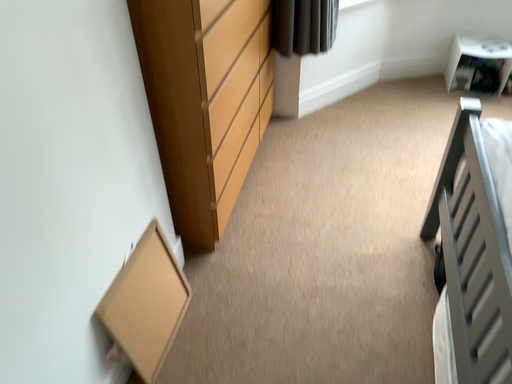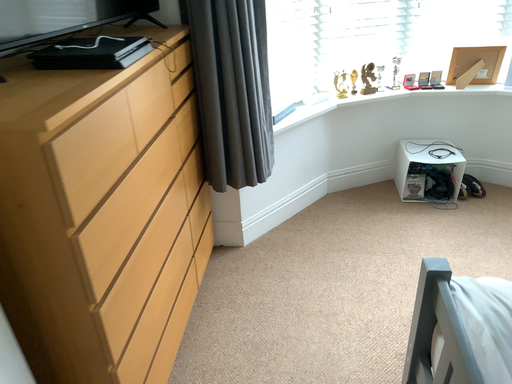
Question: How did the camera likely rotate when shooting the video?

Choices:
 (A) rotated upward
 (B) rotated downward

Answer: (A)